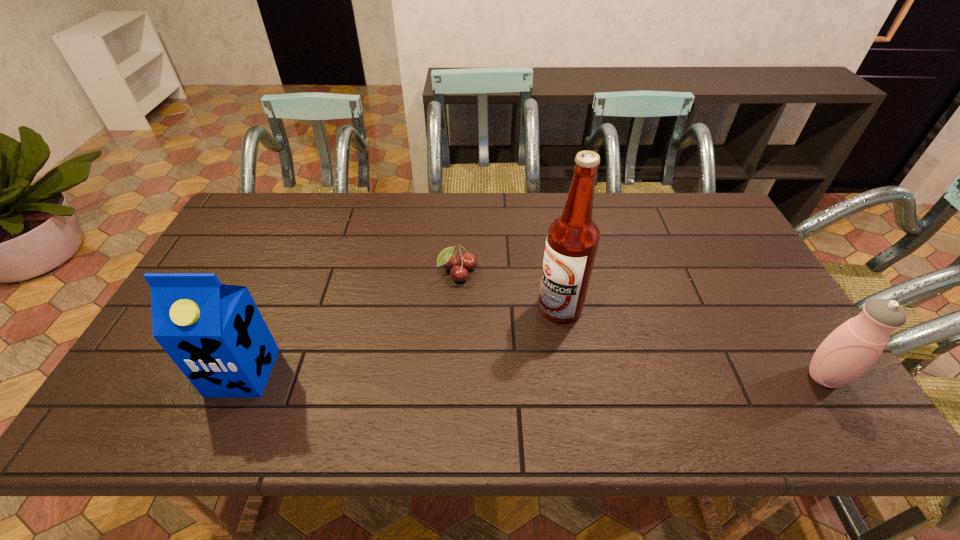
I want to click on vacant space that's between the third nearest object and the third tallest object, so click(692, 342).

Locate an element on the screen. The image size is (960, 540). vacant point located between the tallest object and the second tallest object is located at coordinates (401, 340).

You are a GUI agent. You are given a task and a screenshot of the screen. Output one action in this format:
    pyautogui.click(x=<x>, y=<y>)
    Task: Click on the unoccupied area between the third object from left to right and the farthest object
    Image resolution: width=960 pixels, height=540 pixels.
    Given the screenshot: What is the action you would take?
    pyautogui.click(x=509, y=291)

Where is `vacant region between the farthest object and the third shortest object`? This screenshot has height=540, width=960. vacant region between the farthest object and the third shortest object is located at coordinates (350, 323).

Select which object is the third closest to the second object from left to right. Please provide its 2D coordinates. Your answer should be formatted as a tuple, i.e. [(x, y)], where the tuple contains the x and y coordinates of a point satisfying the conditions above.

[(854, 346)]

Locate an element on the screen. object that is the closest to the shortest object is located at coordinates (572, 241).

You are a GUI agent. You are given a task and a screenshot of the screen. Output one action in this format:
    pyautogui.click(x=<x>, y=<y>)
    Task: Click on the free spot that satisfies the following two spatial constraints: 1. with the cap open on the carton; 2. on the left side of the second shortest object
    The image size is (960, 540).
    Given the screenshot: What is the action you would take?
    pyautogui.click(x=241, y=377)

Find the location of a particular element. free space that satisfies the following two spatial constraints: 1. on the front side of the farthest object; 2. on the right side of the thermos bottle is located at coordinates (453, 377).

The image size is (960, 540). Find the location of `free space that satisfies the following two spatial constraints: 1. on the front side of the cherry; 2. on the left side of the thermos bottle`. free space that satisfies the following two spatial constraints: 1. on the front side of the cherry; 2. on the left side of the thermos bottle is located at coordinates (453, 377).